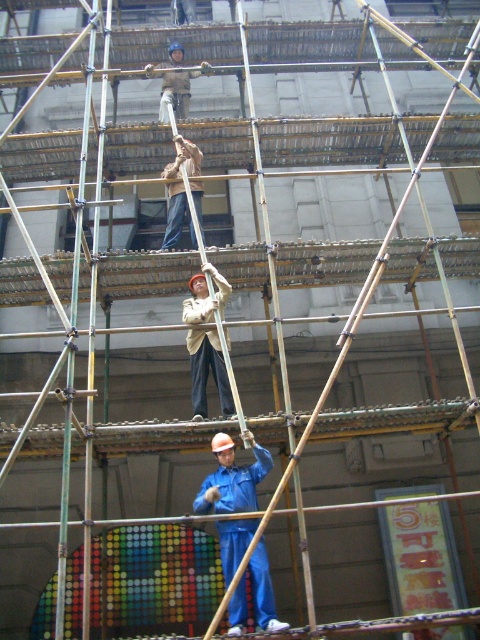
You are a safety inspector reviewing the construction site image. You notice two workers in the scene. One is wearing a light beige fabric jacket at center and the other is a light brown fabric construction worker at upper center. Which worker is wearing a larger jacket?

The light beige fabric jacket at center is bigger than the light brown fabric construction worker at upper center, so the worker wearing the light beige fabric jacket at center has the larger jacket.

You are a safety inspector observing the construction site. You notice the green bamboo scaffolding at center and the blue matte jumpsuit at center. Which object is significantly taller?

The green bamboo scaffolding at center is much taller than the blue matte jumpsuit at center.

In the scene shown: You are a safety inspector standing at the base of the scaffolding and need to assess the distance between you and the worker in the blue matte jumpsuit at center. According to the provided information, what is the exact distance in meters?

The blue matte jumpsuit at center is exactly 30.51 meters away from the viewer.